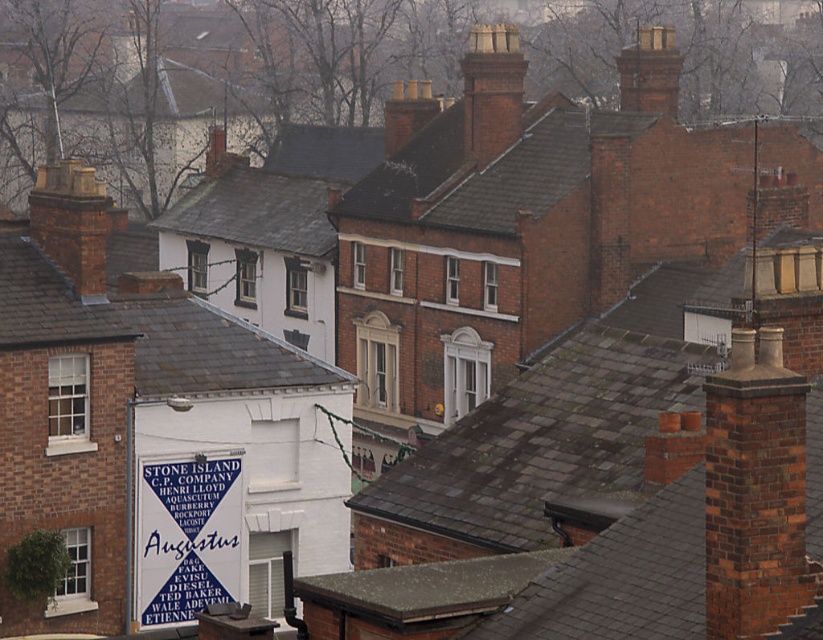
Which of these two, red brick chimney at center or red brick chimney at upper right, stands shorter?

red brick chimney at upper right

Is point (472, 88) positioned before point (670, 61)?

Yes.

Is point (472, 132) positioned behind point (654, 68)?

No, it is in front of (654, 68).

Where is `red brick chimney at center`? The width and height of the screenshot is (823, 640). red brick chimney at center is located at coordinates (491, 92).

Is blue paper sign at center to the left of red brick chimney at upper right from the viewer's perspective?

Indeed, blue paper sign at center is positioned on the left side of red brick chimney at upper right.

What do you see at coordinates (187, 538) in the screenshot?
I see `blue paper sign at center` at bounding box center [187, 538].

Where is `blue paper sign at center`? The image size is (823, 640). blue paper sign at center is located at coordinates (187, 538).

Can you confirm if blue paper sign at center is positioned to the right of red brick chimney at center?

Incorrect, blue paper sign at center is not on the right side of red brick chimney at center.

Is point (166, 536) less distant than point (495, 80)?

Yes, point (166, 536) is closer to viewer.

I want to click on blue paper sign at center, so click(x=187, y=538).

At what (x,y) coordinates should I click in order to perform the action: click on blue paper sign at center. Please return your answer as a coordinate pair (x, y). Image resolution: width=823 pixels, height=640 pixels. Looking at the image, I should click on (187, 538).